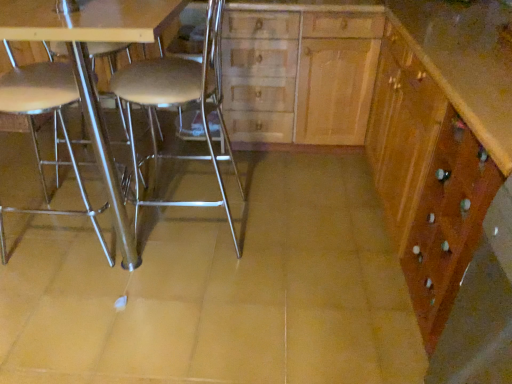
Question: Is point (212, 82) positioned closer to the camera than point (0, 231)?

Choices:
 (A) closer
 (B) farther

Answer: (A)

Question: Based on their positions, is metallic silver stool at center, the first chair from the right, located to the left or right of metallic silver chair at left, arranged as the second chair when viewed from the right?

Choices:
 (A) left
 (B) right

Answer: (B)

Question: Considering the real-world distances, which object is closest to the metallic silver chair at left, arranged as the second chair when viewed from the right?

Choices:
 (A) wooden cabinet at center
 (B) metallic silver stool at center, the first chair from the right
 (C) metallic silver table at center
 (D) wooden cabinet at right

Answer: (C)

Question: Estimate the real-world distances between objects in this image. Which object is closer to the wooden cabinet at right?

Choices:
 (A) wooden cabinet at center
 (B) metallic silver stool at center, placed as the 2th chair when sorted from left to right
 (C) metallic silver table at center
 (D) metallic silver chair at left, arranged as the second chair when viewed from the right

Answer: (A)